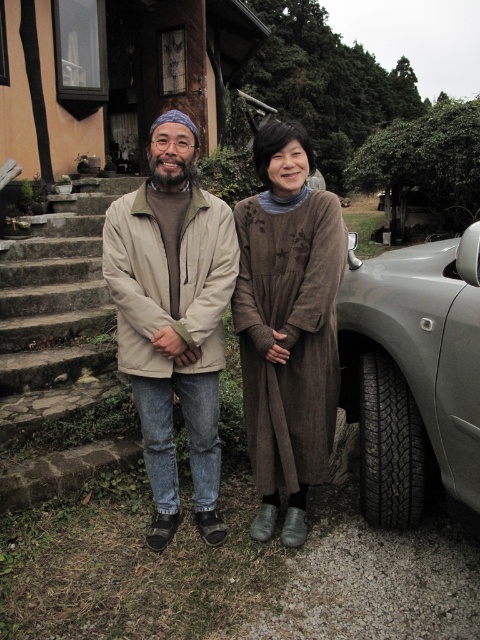
You are a photographer setting up a shot of the beige fabric jacket at center and the brown textured dress at lower right. Which of the two items is positioned closer to you?

The beige fabric jacket at center is closer to the viewer than the brown textured dress at lower right.

You are a delivery person trying to place a package on the ground between the brown textured dress at lower right and the black rubber tire at lower right. Can you fit the package there?

The brown textured dress at lower right is positioned over the black rubber tire at lower right, so there is no space between them to place the package.